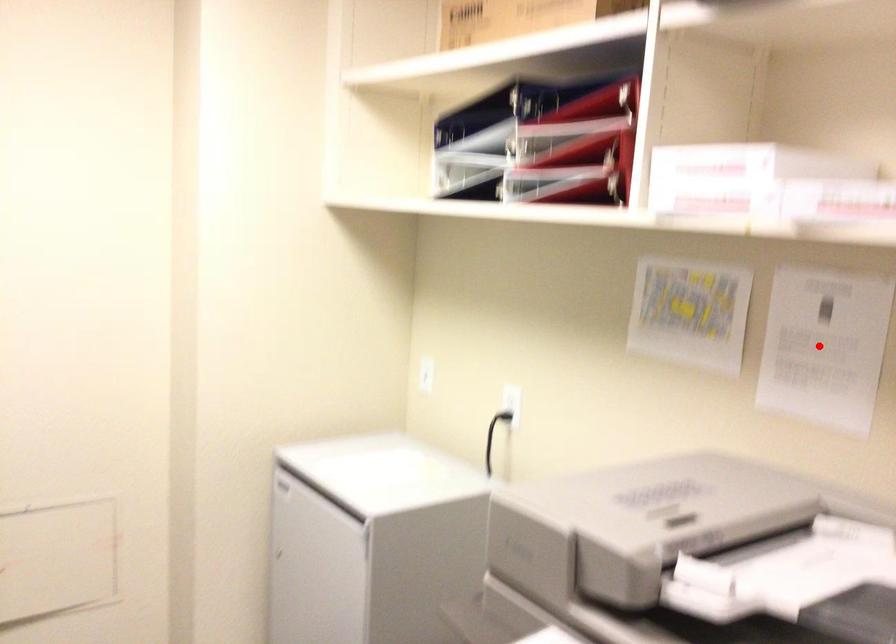
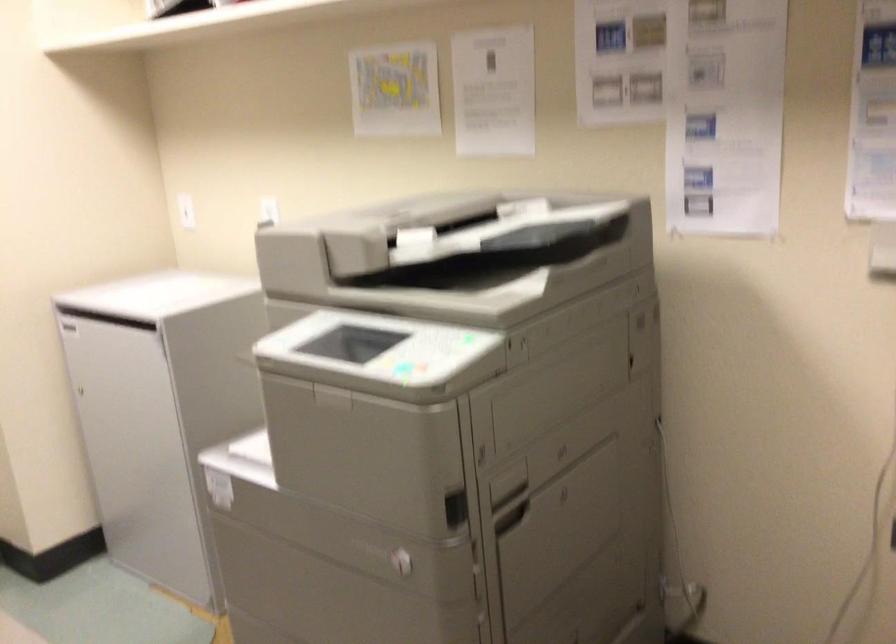
Find the pixel in the second image that matches the highlighted location in the first image.

(494, 91)